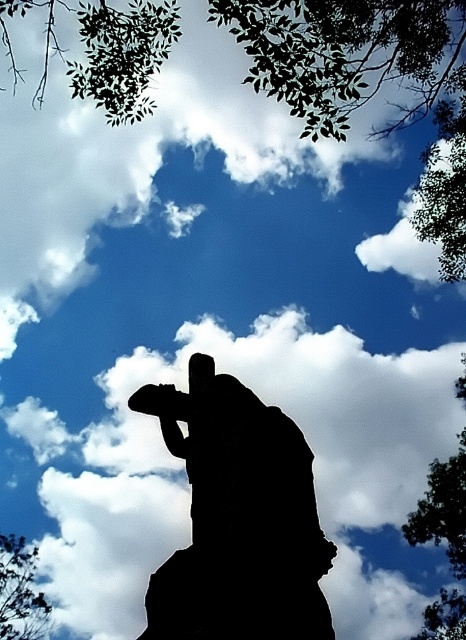
You are a photographer trying to capture the black silhouette skateboarder at center and the green leafy tree at upper left in your shot. Which object appears bigger in the image?

The black silhouette skateboarder at center appears bigger because its width is larger than the green leafy tree at upper left.

Based on the coordinates provided, where is the black silhouette skateboarder at center located in the image?

The black silhouette skateboarder at center is located at point coordinates of (238,516).

Looking at this image, you are a photographer trying to capture a photo where the black silhouette skateboarder at center and the green leafy tree at upper left are both visible. Based on their sizes in the image, which object would appear larger in your photo?

The black silhouette skateboarder at center appears larger in the photo because it is taller than the green leafy tree at upper left.